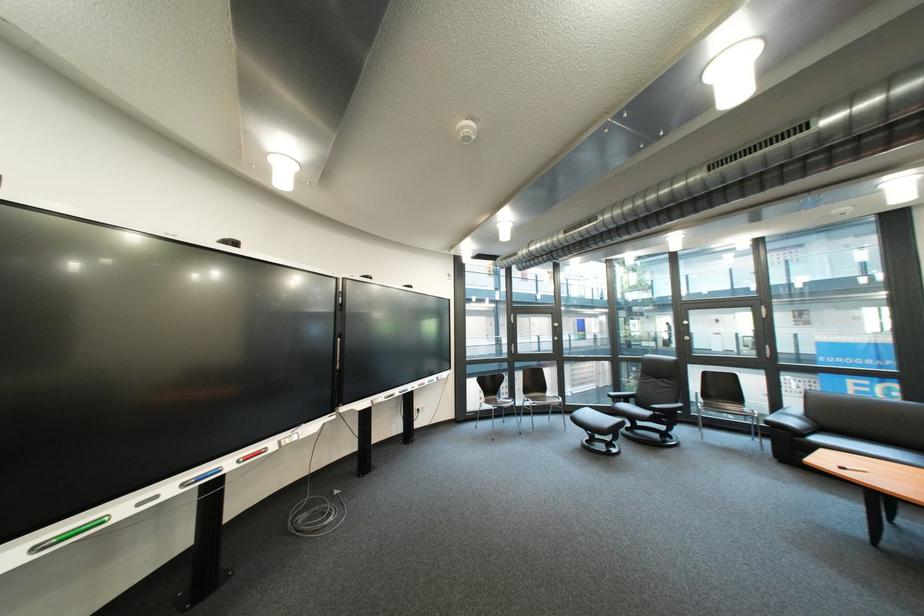
Locate an element on the screen. black leather footrest is located at coordinates (598, 430).